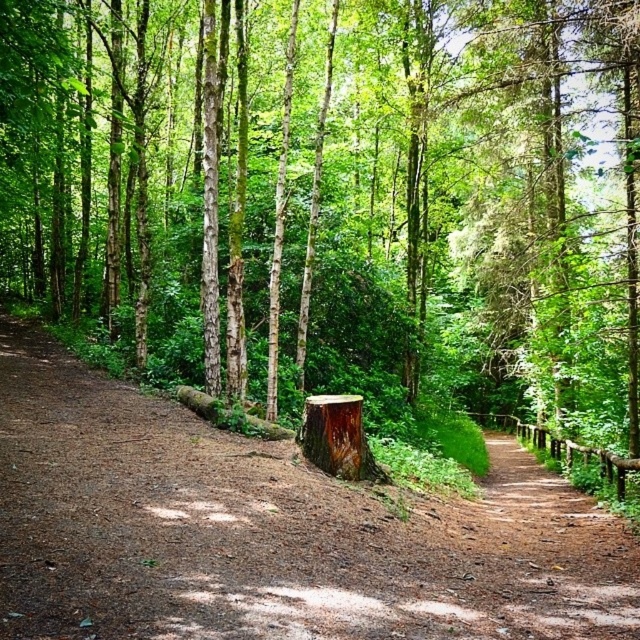
You are a hiker walking along the dirt path in the forest scene. You notice two stumps, the brown rough tree stump at center and the rough wood stump at center. Which stump is located to the left side of the other?

The brown rough tree stump at center is positioned on the left side of the rough wood stump at center.

You are a hiker who wants to walk on the brown dirt path at center. Is the point at coordinates [269,531] on the path?

Yes, the brown dirt path at center is located at point [269,531], so the hiker can walk there.

In the scene shown: You are a hiker trying to cross the brown dirt path at center. There is a brown rough tree stump at center blocking your way. Can you step over it without needing to climb?

The brown rough tree stump at center is taller than the brown dirt path at center. Since the stump is taller, it might be difficult to step over without climbing, so you should consider going around it instead.